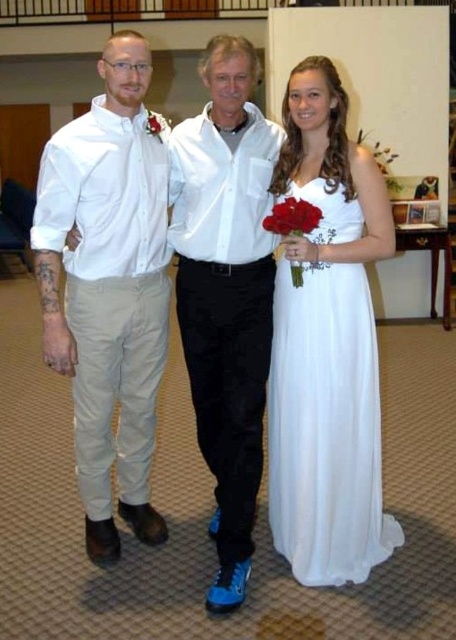
Is point (165, 129) farther from camera compared to point (157, 131)?

Yes, it is behind point (157, 131).

At what (x,y) coordinates should I click in order to perform the action: click on matte white boutonniere at upper center. Please return your answer as a coordinate pair (x, y). Image resolution: width=456 pixels, height=640 pixels. Looking at the image, I should click on (156, 125).

Who is higher up, matte khaki pants at left or white smooth shirt at center?

matte khaki pants at left is above.

Who is more distant from viewer, (43, 227) or (238, 467)?

Positioned behind is point (238, 467).

This screenshot has height=640, width=456. I want to click on matte khaki pants at left, so click(108, 289).

Can you confirm if bright red silk bouquet at center is taller than matte red rose at upper center?

Correct, bright red silk bouquet at center is much taller as matte red rose at upper center.

What do you see at coordinates (293, 218) in the screenshot? The width and height of the screenshot is (456, 640). I see `bright red silk bouquet at center` at bounding box center [293, 218].

The width and height of the screenshot is (456, 640). In order to click on bright red silk bouquet at center in this screenshot , I will do `click(293, 218)`.